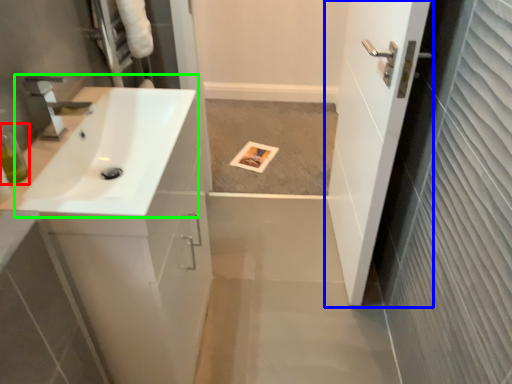
Question: Estimate the real-world distances between objects in this image. Which object is farther from toiletry (highlighted by a red box), door (highlighted by a blue box) or sink (highlighted by a green box)?

Choices:
 (A) door
 (B) sink

Answer: (A)